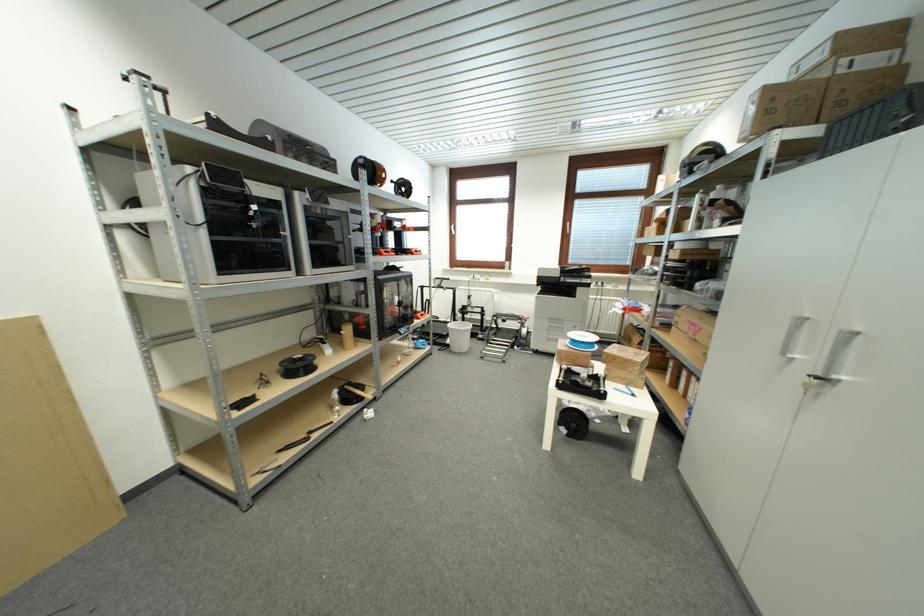
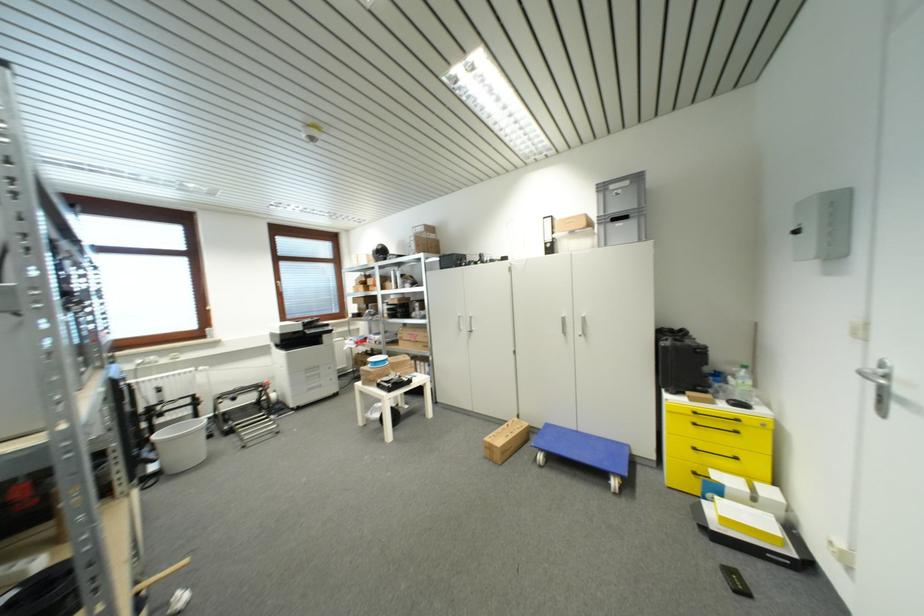
Where in the second image is the point corresponding to point (456, 351) from the first image?

(177, 472)